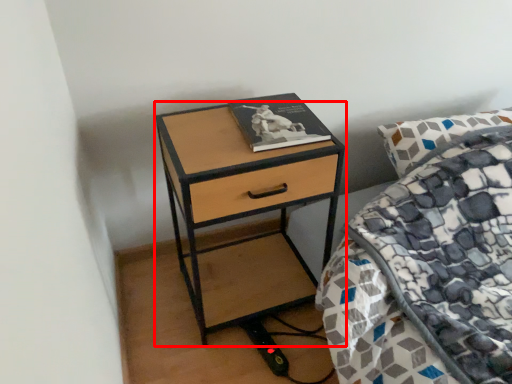
Question: Considering the relative positions of nightstand (annotated by the red box) and book in the image provided, where is nightstand (annotated by the red box) located with respect to the staircase?

Choices:
 (A) left
 (B) right

Answer: (A)